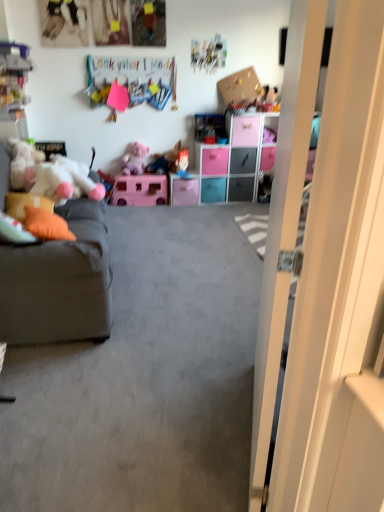
Question: Is pink plastic drawer at center, marked as the 6th drawer in a right-to-left arrangement, taller or shorter than plush pink teddy bear at center, arranged as the second toy when viewed from the front?

Choices:
 (A) tall
 (B) short

Answer: (B)

Question: From the image's perspective, is pink plastic drawer at center, marked as the 6th drawer in a right-to-left arrangement, above or below plush pink teddy bear at center, placed as the 2th toy when sorted from left to right?

Choices:
 (A) above
 (B) below

Answer: (B)

Question: Estimate the real-world distances between objects in this image. Which object is farther from the orange fabric pillow at left, arranged as the 2th pillow when viewed from the left?

Choices:
 (A) gray fabric couch at left
 (B) pink plastic drawer at center, which is the 3th drawer from left to right
 (C) pink matte toy car at center
 (D) black plastic drawer at center, the 3th drawer when ordered from right to left
 (E) plush pink teddy bear at center, positioned as the 4th toy in back-to-front order

Answer: (D)

Question: Based on their relative distances, which object is farther from the gray fabric couch at left?

Choices:
 (A) orange fabric pillow at left, which appears as the first pillow when viewed from the right
 (B) pink matte toy car at center
 (C) pink plastic drawer at center, arranged as the first drawer when viewed from the left
 (D) white glossy door at right
 (E) gray carpet at center

Answer: (C)